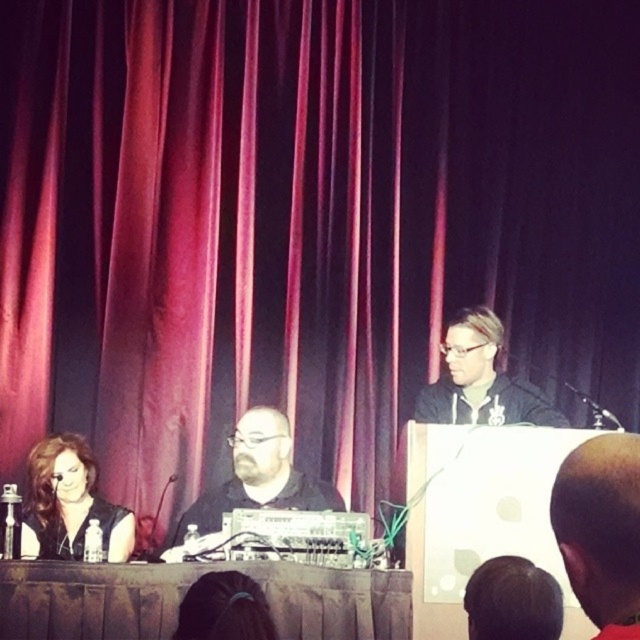
You are a stagehand who needs to move a 10 feet long ladder from the left side of the table to the right side. The ladder is currently placed at the point labeled as point (x=317, y=570). Is there enough space between the two points to move the ladder without it hitting anything?

The distance between the two points is 9.06 feet, which is less than the ladder length of 10 feet. Therefore, moving the ladder would not be possible without it hitting something.